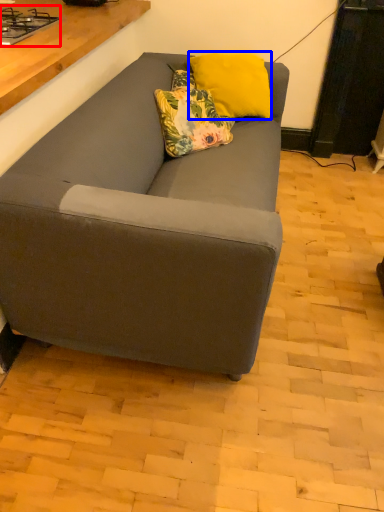
Question: Which object is closer to the camera taking this photo, gas stove (highlighted by a red box) or pillow (highlighted by a blue box)?

Choices:
 (A) gas stove
 (B) pillow

Answer: (A)